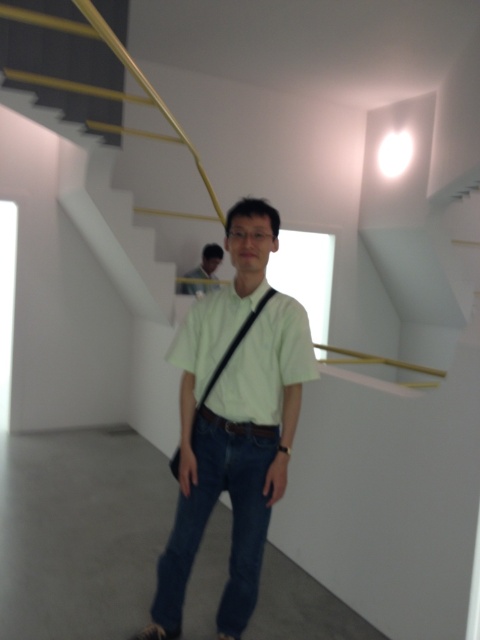
You are a fashion designer observing the image. You need to determine the order of layers for the clothing items. Which clothing item is closer to the viewer between the denim at center and the matte black shirt at center?

The denim at center is positioned under the matte black shirt at center, so the matte black shirt at center is closer to the viewer.

You are a photographer standing at the shooting position. You want to capture a closeup shot of the light green cotton shirt at center. Considering the camera lens you have can focus as close as 5 feet. Can you get a clear closeup without moving closer?

The light green cotton shirt at center is 6.35 feet away from the camera. Since the minimum focusing distance of the camera lens is 5 feet, the photographer can get a clear closeup without moving closer because the shirt is within the focus range.

Based on the photo, you are a fashion designer who needs to place a mannequin between the light green cotton shirt at center and the matte black shirt at center. The mannequin requires 8 feet of space. Is there enough space between them to accommodate the mannequin?

The distance between the light green cotton shirt at center and the matte black shirt at center is 9.02 feet, which is more than the 8 feet required for the mannequin. Therefore, there is sufficient space to place the mannequin between them.